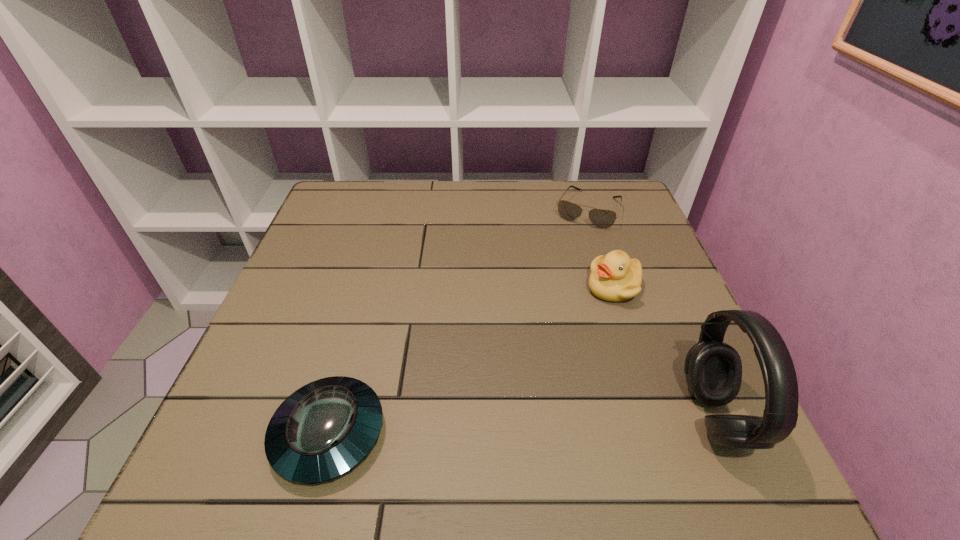
This screenshot has width=960, height=540. Find the location of `the leftmost object`. the leftmost object is located at coordinates (323, 430).

Where is `the tallest object`? The width and height of the screenshot is (960, 540). the tallest object is located at coordinates (713, 369).

The height and width of the screenshot is (540, 960). I want to click on the third shortest object, so click(615, 277).

I want to click on duckling, so click(615, 277).

This screenshot has height=540, width=960. What are the coordinates of `sunglasses` in the screenshot? It's located at point(601,218).

Image resolution: width=960 pixels, height=540 pixels. Find the location of `free location located on the back of the saucer`. free location located on the back of the saucer is located at coordinates (370, 285).

Locate an element on the screen. The height and width of the screenshot is (540, 960). free space located 0.270m on the beak of the second tallest object is located at coordinates (549, 396).

The width and height of the screenshot is (960, 540). What are the coordinates of `vacant region located 0.230m on the beak of the second tallest object` in the screenshot? It's located at (559, 380).

Find the location of a particular element. This screenshot has height=540, width=960. vacant space situated 0.170m on the beak of the second tallest object is located at coordinates (572, 358).

At what (x,y) coordinates should I click in order to perform the action: click on vacant space located 0.360m on the front-facing side of the farthest object. Please return your answer as a coordinate pair (x, y). The width and height of the screenshot is (960, 540). Looking at the image, I should click on (537, 321).